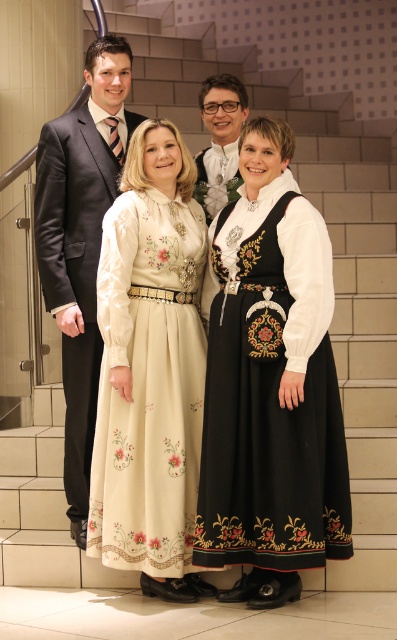
You are organizing a group photo and need to arrange the participants in a straight line. The two people at the center are wearing a cream satin dress at center and a matte white shirt at center. Which one should you place on the left to avoid overcrowding the line?

The cream satin dress at center might be wider than matte white shirt at center, so placing the cream satin dress at center on the left would provide more space to accommodate its width in the line.

You are standing at the point with coordinates point (208,108) and want to walk to the door located at point (90,451). Is the door in front of you or behind you?

The point (90,451) is in front of point (208,108), so the door is in front of you.

You are standing at the entrance of the room and want to move towards the point at coordinates point (165, 563). There is an obstacle at point (221, 144). Will you encounter the obstacle before reaching your destination?

Point (165, 563) is in front of point (221, 144), so you will reach the destination before encountering the obstacle.